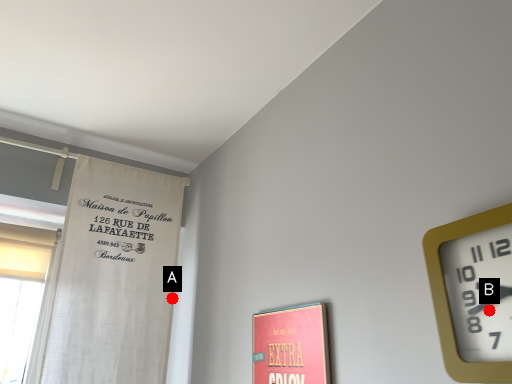
Question: Two points are circled on the image, labeled by A and B beside each circle. Which point appears farthest from the camera in this image?

Choices:
 (A) A is further
 (B) B is further

Answer: (A)